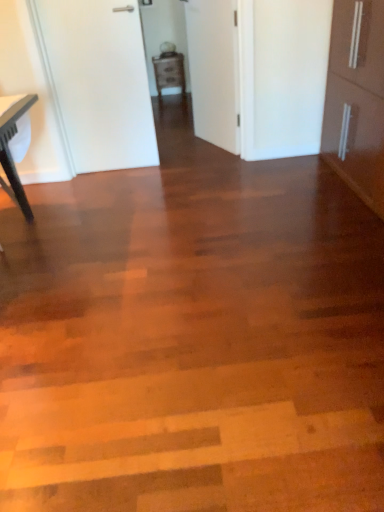
Question: Considering the positions of white matte door at center, which is the first door from right to left, and matte black table at left in the image, is white matte door at center, which is the first door from right to left, bigger or smaller than matte black table at left?

Choices:
 (A) big
 (B) small

Answer: (B)

Question: From a real-world perspective, is white matte door at center, which is the first door from right to left, above or below matte black table at left?

Choices:
 (A) below
 (B) above

Answer: (B)

Question: Which object is the farthest from the white matte door at center, which is the first door from right to left?

Choices:
 (A) white matte door at upper left, marked as the second door in a right-to-left arrangement
 (B) matte black table at left
 (C) matte brown cabinet at center

Answer: (C)

Question: Which object is the closest to the matte black table at left?

Choices:
 (A) matte brown cabinet at center
 (B) white matte door at upper left, the 1th door from the left
 (C) white matte door at center, which is the first door from right to left

Answer: (B)